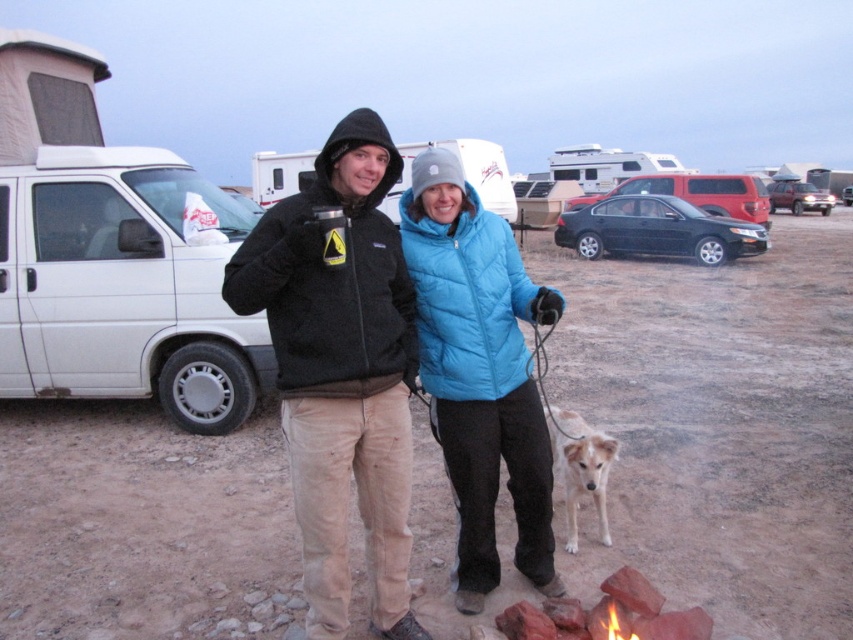
Question: Is white matte van at left positioned before satin black sedan at center?

Choices:
 (A) no
 (B) yes

Answer: (B)

Question: Considering the relative positions of white matte van at left and satin black sedan at center in the image provided, where is white matte van at left located with respect to satin black sedan at center?

Choices:
 (A) above
 (B) below

Answer: (B)

Question: Which point appears closest to the camera in this image?

Choices:
 (A) (340, 168)
 (B) (693, 192)
 (C) (152, 250)

Answer: (A)

Question: Among these objects, which one is nearest to the camera?

Choices:
 (A) blue puffy vest at center
 (B) light brown fur at center
 (C) satin black sedan at center
 (D) matte black jacket at center

Answer: (D)

Question: Which of the following is the farthest from the observer?

Choices:
 (A) blue puffy vest at center
 (B) satin black sedan at center

Answer: (B)

Question: Can you confirm if light brown fur at center is positioned to the left of satin black sedan at center?

Choices:
 (A) no
 (B) yes

Answer: (B)